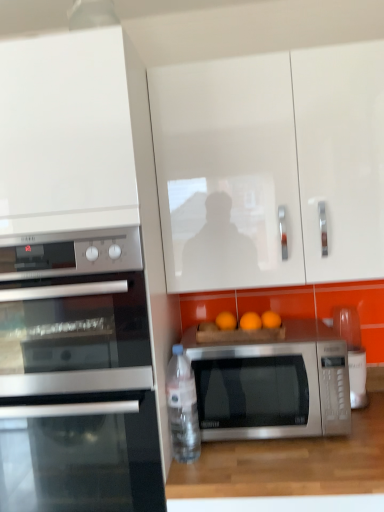
The height and width of the screenshot is (512, 384). What are the coordinates of `free location to the right of clear plastic bottle at lower center` in the screenshot? It's located at (231, 453).